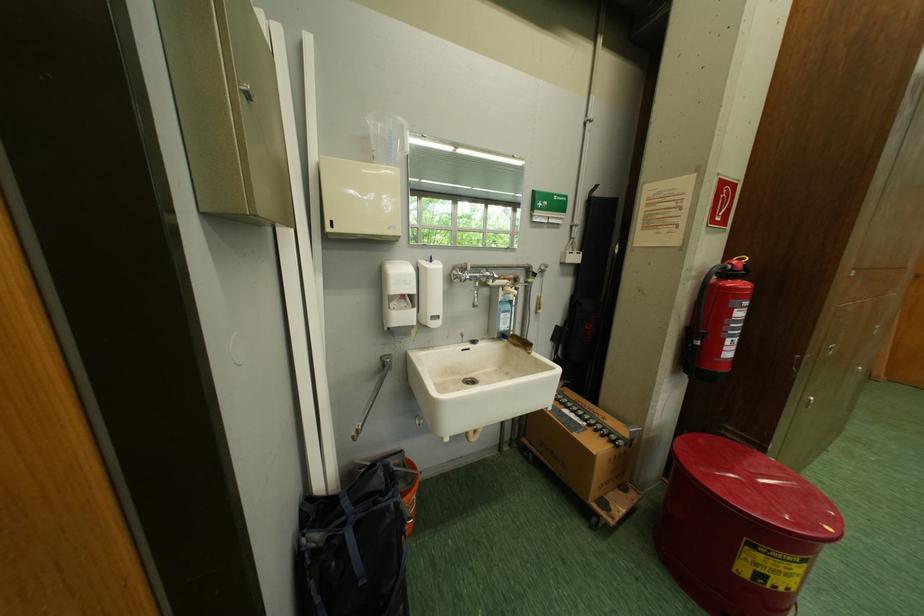
This screenshot has height=616, width=924. What do you see at coordinates (757, 484) in the screenshot?
I see `the red bin lid` at bounding box center [757, 484].